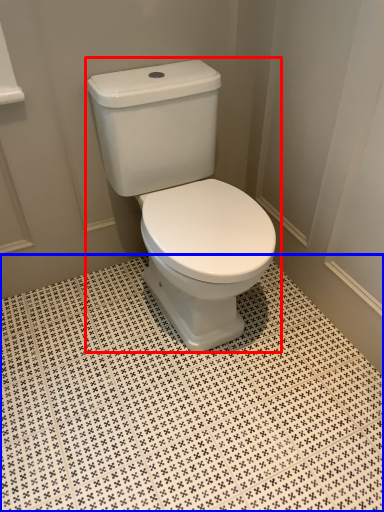
Question: Which object is closer to the camera taking this photo, toilet (highlighted by a red box) or ceramic tile (highlighted by a blue box)?

Choices:
 (A) toilet
 (B) ceramic tile

Answer: (B)